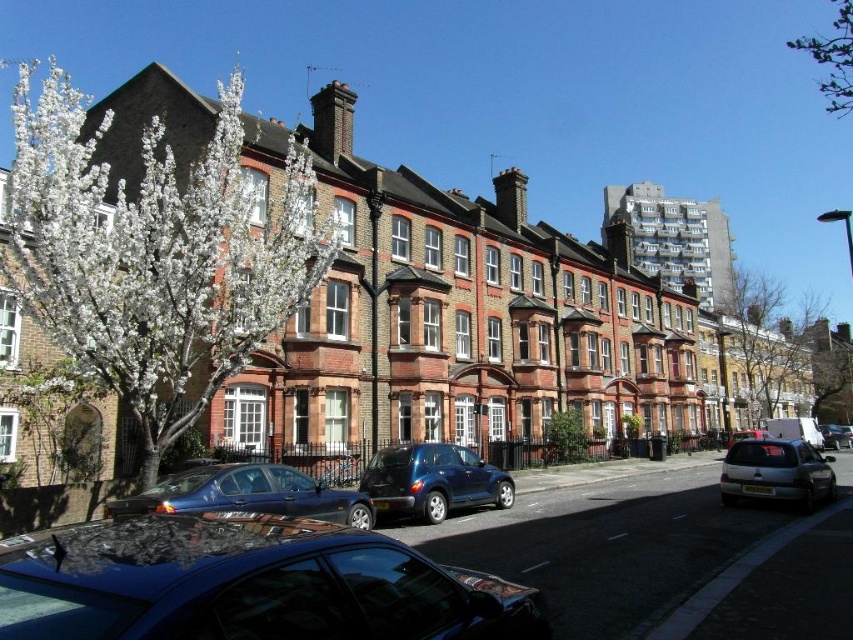
Question: Among these objects, which one is farthest from the camera?

Choices:
 (A) metallic silver car at center
 (B) glossy black car at lower center
 (C) white blossoms at left

Answer: (A)

Question: Can you confirm if glossy black car at lower center is bigger than green leafy tree at upper right?

Choices:
 (A) yes
 (B) no

Answer: (B)

Question: Considering the real-world distances, which object is closest to the glossy blue car at center?

Choices:
 (A) bare branches at upper center
 (B) glossy metallic sedan at center
 (C) metallic silver car at center
 (D) glossy black car at lower center

Answer: (B)

Question: Can you confirm if bare branches at upper center is positioned to the right of glossy metallic sedan at center?

Choices:
 (A) yes
 (B) no

Answer: (A)

Question: Can you confirm if white blossoms at left is smaller than glossy black car at lower center?

Choices:
 (A) no
 (B) yes

Answer: (A)

Question: Among these objects, which one is farthest from the camera?

Choices:
 (A) bare branches at upper center
 (B) white blossoms at left

Answer: (A)